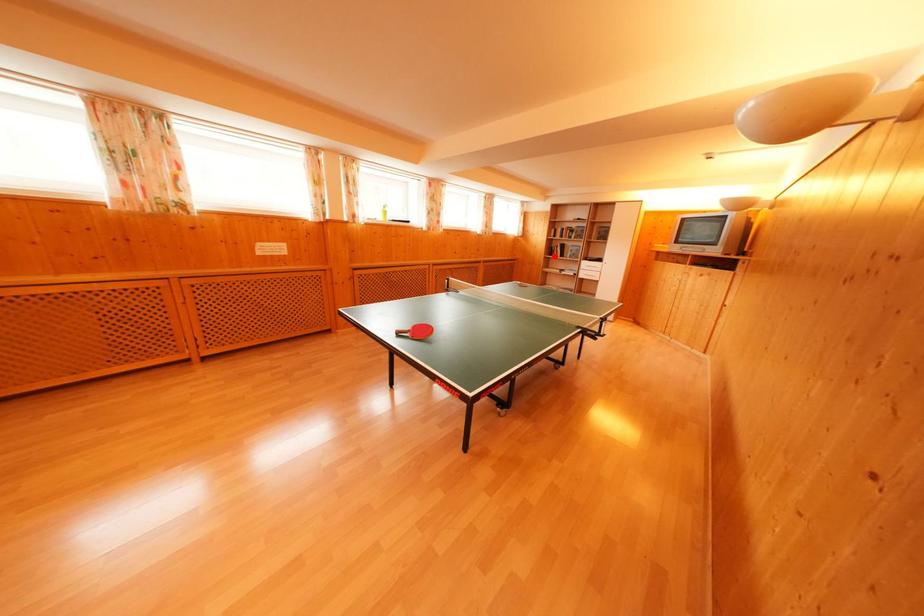
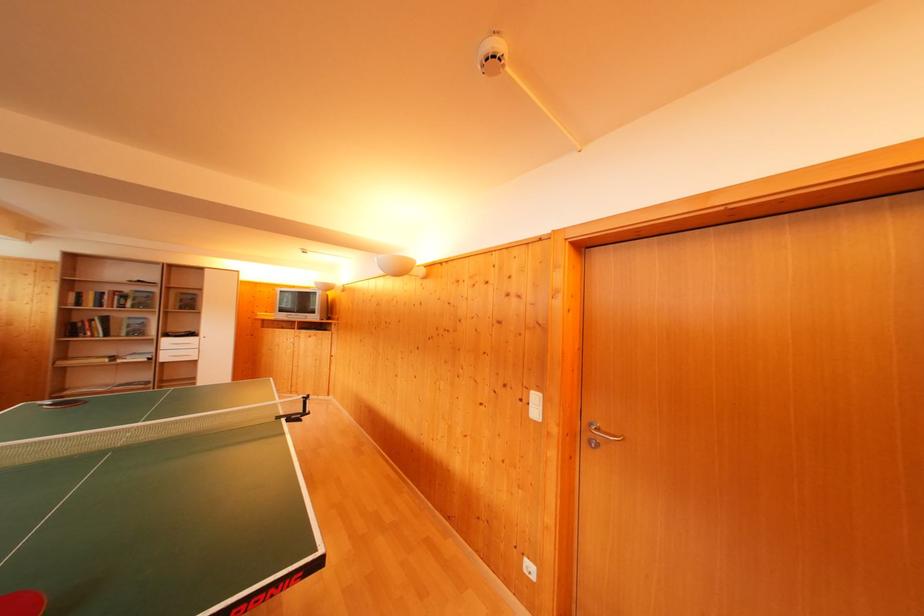
Where in the second image is the point corresponding to the highlighted location from the first image?

(76, 334)